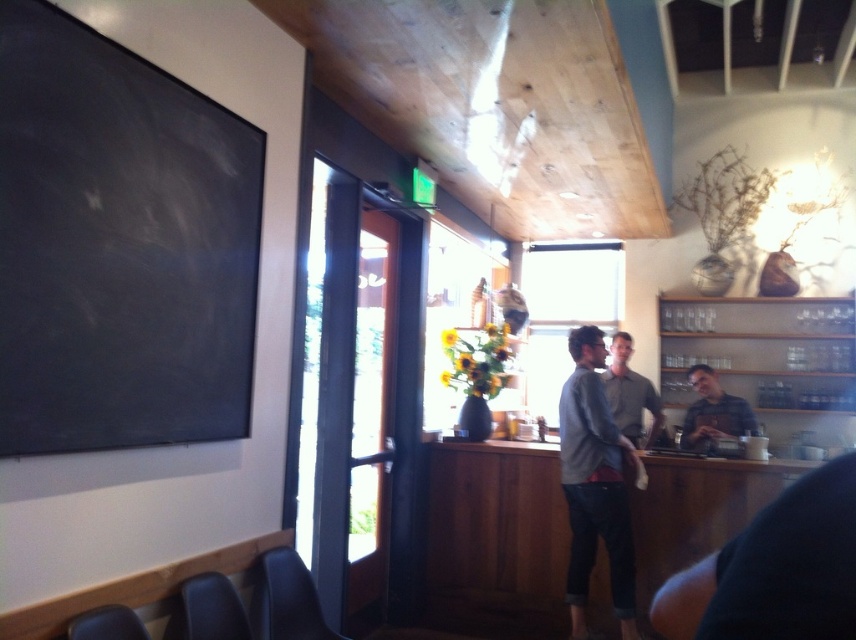
Question: Which object is farther from the camera taking this photo?

Choices:
 (A) matte gray shirt at center
 (B) gray sweater at center

Answer: (B)

Question: Which point is closer to the camera?

Choices:
 (A) (611, 369)
 (B) (134, 321)
 (C) (718, 417)
 (D) (596, 368)

Answer: (B)

Question: Does matte gray shirt at center have a greater width compared to gray sweater at center?

Choices:
 (A) no
 (B) yes

Answer: (B)

Question: Which object is closer to the camera taking this photo?

Choices:
 (A) gray sweater at center
 (B) gray cotton sweater at center

Answer: (B)

Question: Can you confirm if black chalkboard at upper left is smaller than gray sweater at center?

Choices:
 (A) no
 (B) yes

Answer: (A)

Question: Observing the image, what is the correct spatial positioning of black chalkboard at upper left in reference to matte gray shirt at center?

Choices:
 (A) left
 (B) right

Answer: (A)